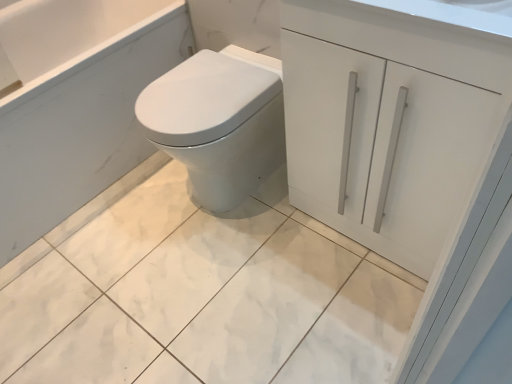
Question: Considering their positions, is white glossy bidet at center located in front of or behind white glossy cabinet at upper right?

Choices:
 (A) front
 (B) behind

Answer: (B)

Question: Is white glossy bidet at center taller or shorter than white glossy cabinet at upper right?

Choices:
 (A) tall
 (B) short

Answer: (A)

Question: Which object is positioned farthest from the white glossy cabinet at upper right?

Choices:
 (A) white glossy bidet at center
 (B) white glossy cabinet at upper right
 (C) white marble tile at center

Answer: (C)

Question: Which is nearer to the white glossy bidet at center?

Choices:
 (A) white marble tile at center
 (B) white glossy cabinet at upper right
 (C) white glossy cabinet at upper right

Answer: (C)